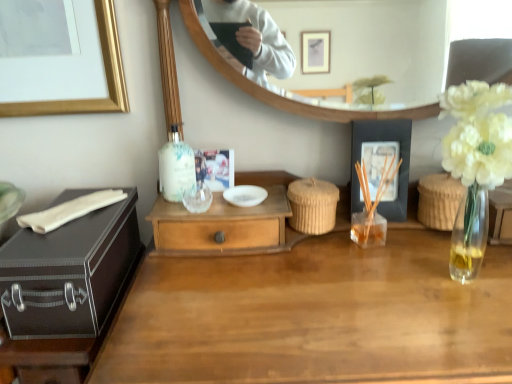
Image resolution: width=512 pixels, height=384 pixels. Identify the location of vacant point to the right of woven straw picnic basket at center, which is the 1th picnic basket in left-to-right order. (393, 236).